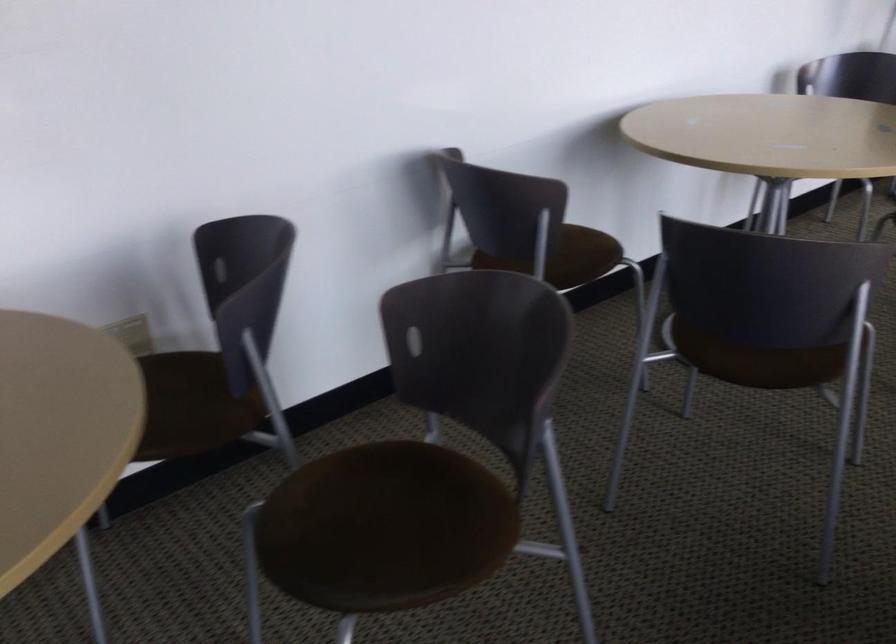
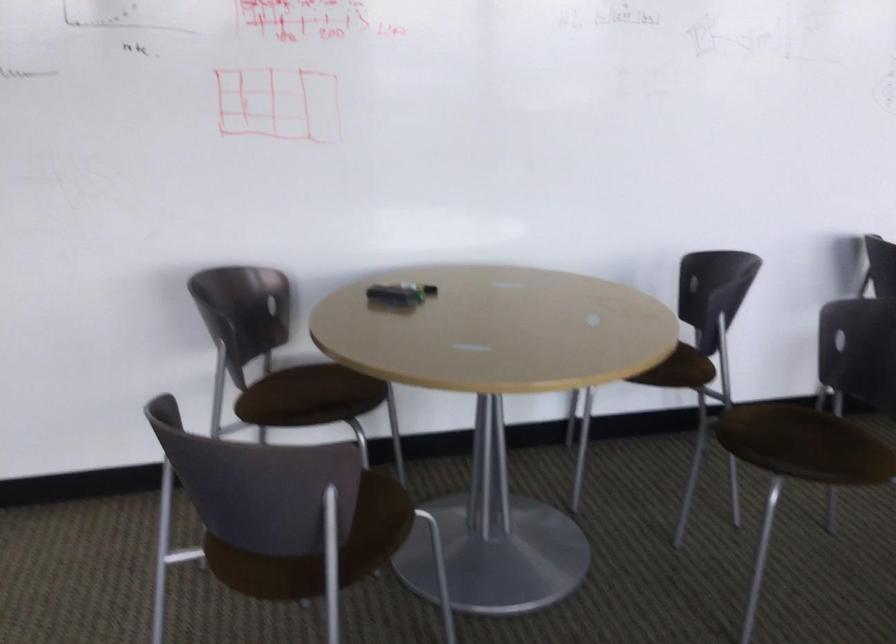
Where in the second image is the point corresponding to pixel 247 402 from the first image?

(690, 368)